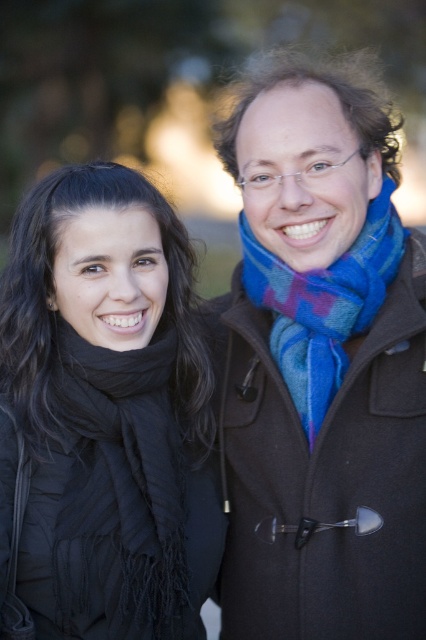
Question: Which point appears farthest from the camera in this image?

Choices:
 (A) (54, 317)
 (B) (279, 593)

Answer: (A)

Question: Based on their relative distances, which object is nearer to the black soft scarf at left?

Choices:
 (A) blue woven scarf at center
 (B) black wool coat at right

Answer: (B)

Question: Observing the image, what is the correct spatial positioning of black wool coat at right in reference to blue woven scarf at center?

Choices:
 (A) left
 (B) right

Answer: (B)

Question: Which point appears closest to the camera in this image?

Choices:
 (A) (345, 317)
 (B) (322, 424)

Answer: (B)

Question: Is black soft scarf at left to the right of blue woven scarf at center from the viewer's perspective?

Choices:
 (A) no
 (B) yes

Answer: (A)

Question: Is black wool coat at right positioned before blue woven scarf at center?

Choices:
 (A) yes
 (B) no

Answer: (A)